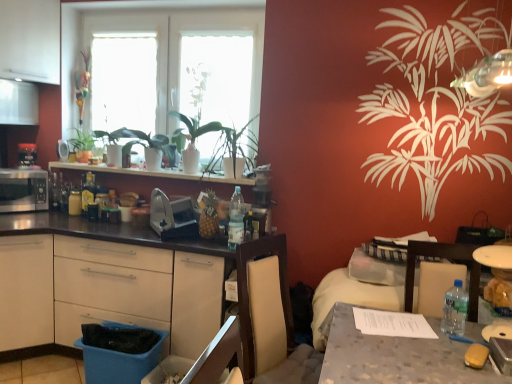
Where is `vacant space situated above white matte window screen at upper center, which ranks as the 1th window screen in right-to-left order (from a real-world perspective)`? This screenshot has height=384, width=512. vacant space situated above white matte window screen at upper center, which ranks as the 1th window screen in right-to-left order (from a real-world perspective) is located at coordinates (218, 33).